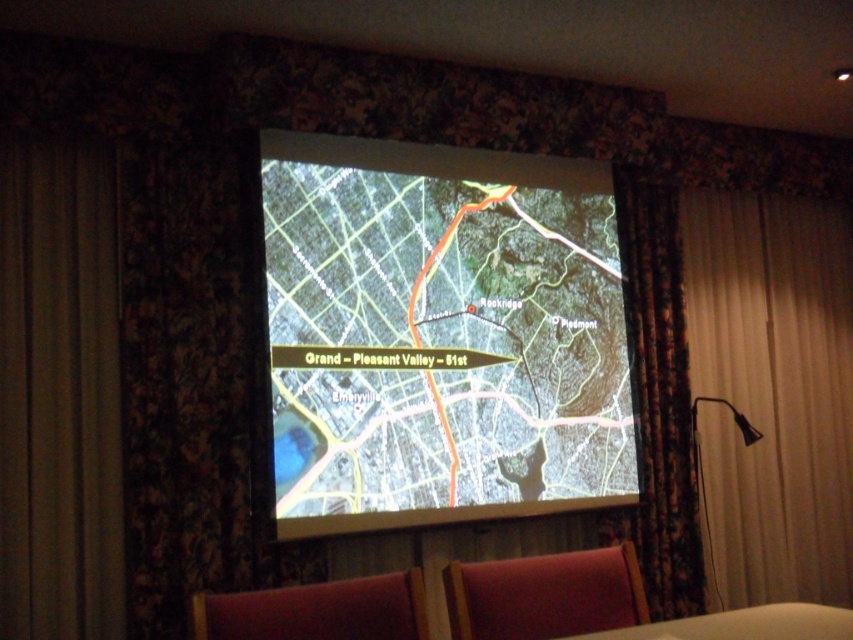
Question: Observing the image, what is the correct spatial positioning of white fabric curtain at right in reference to floral fabric curtain at right?

Choices:
 (A) above
 (B) below

Answer: (B)

Question: Which point is closer to the camera?

Choices:
 (A) velvet pink chair at lower center
 (B) black fabric lamp at lower right
 (C) floral fabric curtain at right
 (D) white fabric curtain at right

Answer: (A)

Question: Estimate the real-world distances between objects in this image. Which object is closer to the black fabric lamp at lower right?

Choices:
 (A) velvet red chair at lower center
 (B) green textured map at center

Answer: (B)

Question: Considering the real-world distances, which object is closest to the black fabric lamp at lower right?

Choices:
 (A) velvet pink chair at lower center
 (B) velvet red chair at lower center
 (C) white fabric curtain at right
 (D) dark fabric curtain at left

Answer: (C)

Question: Observing the image, what is the correct spatial positioning of green textured map at center in reference to white fabric curtain at right?

Choices:
 (A) left
 (B) right

Answer: (A)

Question: Is dark fabric curtain at left below velvet pink chair at lower center?

Choices:
 (A) yes
 (B) no

Answer: (B)